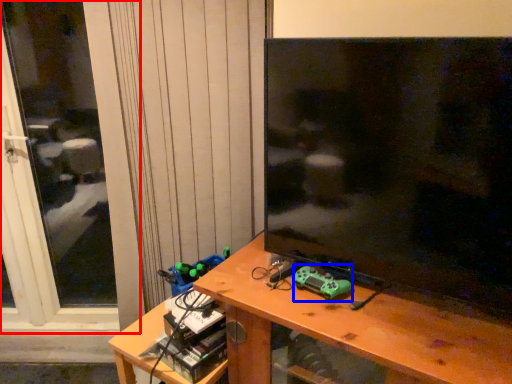
Question: Which of the following is the closest to the observer, screen door (highlighted by a red box) or toy (highlighted by a blue box)?

Choices:
 (A) screen door
 (B) toy

Answer: (B)